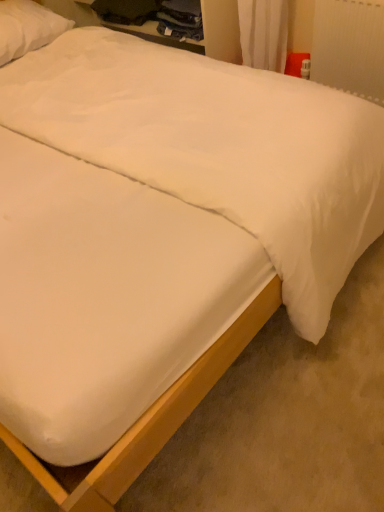
Question: Relative to white smooth mattress at center, is white soft pillow at upper left in front or behind?

Choices:
 (A) front
 (B) behind

Answer: (B)

Question: In the image, is white soft pillow at upper left on the left side or the right side of white smooth mattress at center?

Choices:
 (A) left
 (B) right

Answer: (A)

Question: Estimate the real-world distances between objects in this image. Which object is farther from the white plastic radiator at upper right?

Choices:
 (A) white smooth mattress at center
 (B) white soft pillow at upper left

Answer: (A)

Question: Which of these objects is positioned closest to the white soft pillow at upper left?

Choices:
 (A) white plastic radiator at upper right
 (B) white smooth mattress at center

Answer: (A)